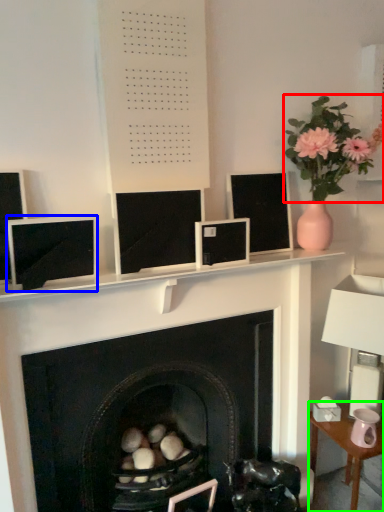
Question: Considering the real-world distances, which object is farthest from floral arrangement (highlighted by a red box)? computer monitor (highlighted by a blue box) or table (highlighted by a green box)?

Choices:
 (A) computer monitor
 (B) table

Answer: (B)